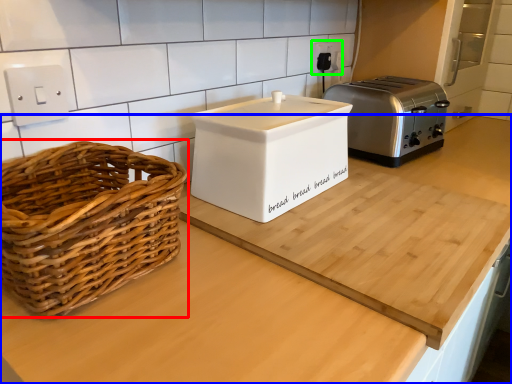
Question: Which object is positioned closest to picnic basket (highlighted by a red box)? Select from countertop (highlighted by a blue box) and electric outlet (highlighted by a green box).

Choices:
 (A) countertop
 (B) electric outlet

Answer: (A)